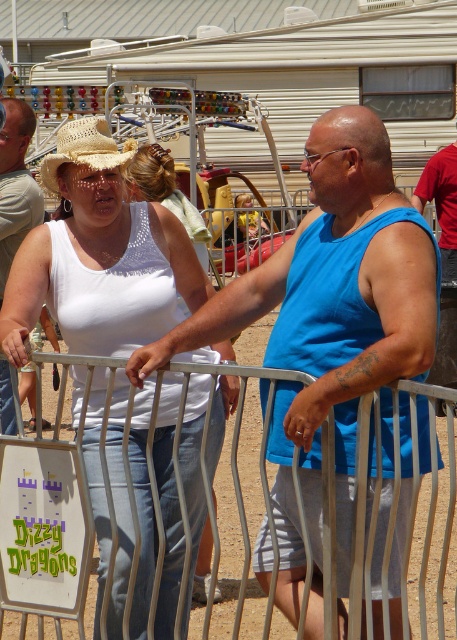
Is white crochet tank top at center shorter than red cotton shirt at upper right?

In fact, white crochet tank top at center may be taller than red cotton shirt at upper right.

Between white crochet tank top at center and red cotton shirt at upper right, which one appears on the left side from the viewer's perspective?

From the viewer's perspective, white crochet tank top at center appears more on the left side.

Does point (72, 180) come in front of point (446, 184)?

Yes, point (72, 180) is closer to viewer.

I want to click on white crochet tank top at center, so click(x=100, y=257).

Is white crochet tank top at center in front of strawhat at center?

That is True.

Between point (132, 442) and point (56, 140), which one is positioned in front?

Positioned in front is point (132, 442).

Who is more distant from viewer, [196,538] or [102,148]?

Positioned behind is point [196,538].

The image size is (457, 640). Identify the location of white crochet tank top at center. (100, 257).

In the scene shown: Between metallic silver gate at center and strawhat at center, which one is positioned lower?

Positioned lower is metallic silver gate at center.

Does metallic silver gate at center appear on the left side of strawhat at center?

In fact, metallic silver gate at center is to the right of strawhat at center.

Is point (244, 611) positioned in front of point (49, 186)?

No, it is behind (49, 186).

This screenshot has height=640, width=457. In order to click on metallic silver gate at center in this screenshot , I will do `click(436, 566)`.